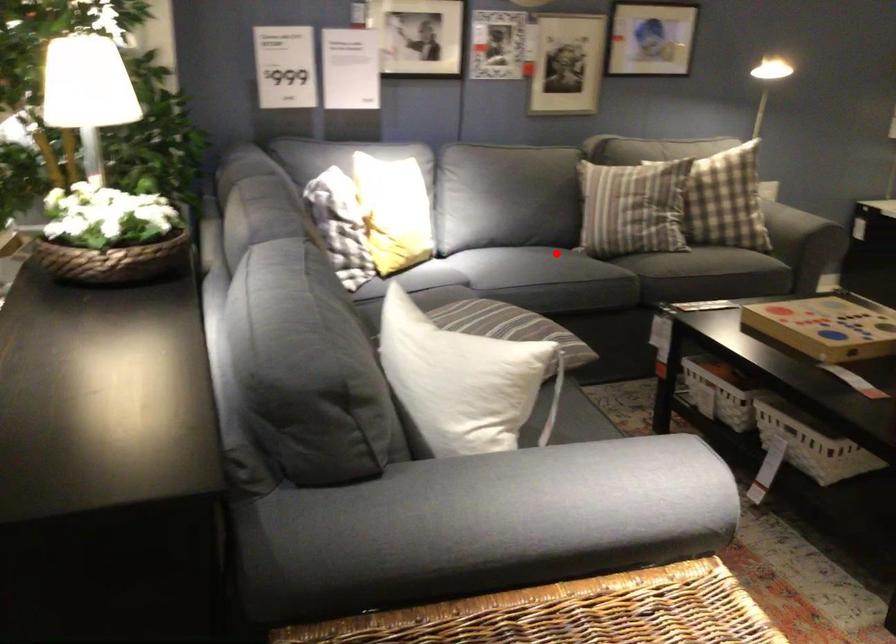
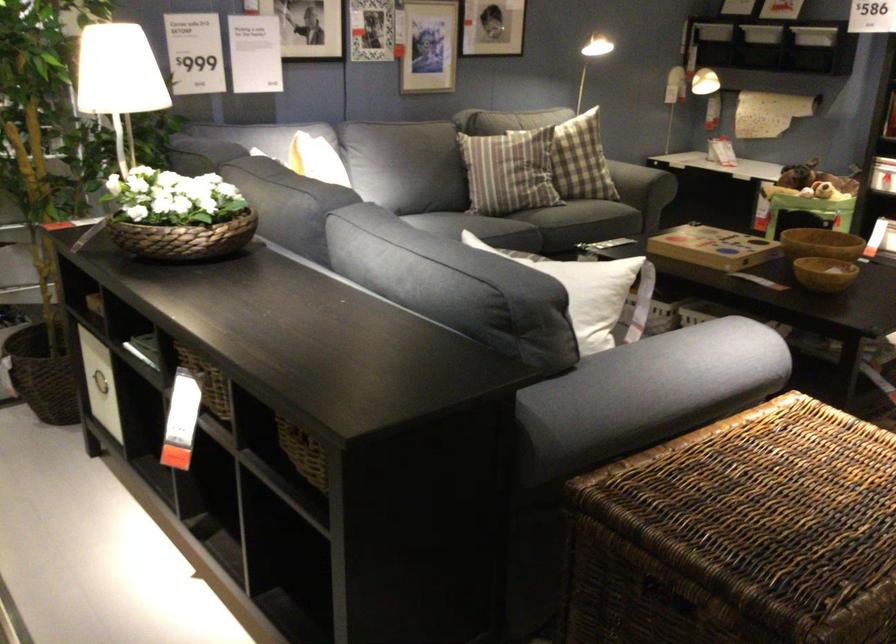
Where in the second image is the point corresponding to the highlighted location from the first image?

(484, 227)